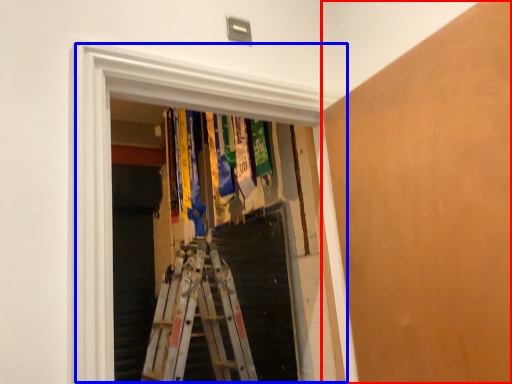
Question: Among these objects, which one is farthest to the camera, plywood (highlighted by a red box) or window (highlighted by a blue box)?

Choices:
 (A) plywood
 (B) window

Answer: (B)